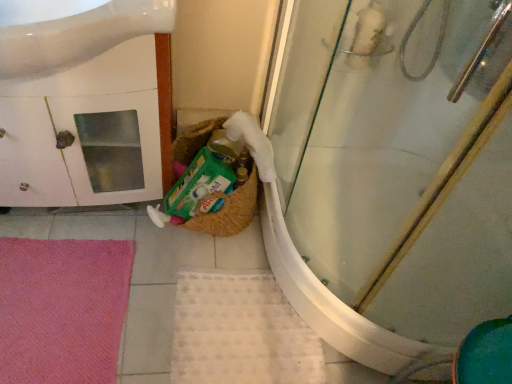
Question: Is white glossy sink at upper left positioned far away from transparent glass shower door at center?

Choices:
 (A) yes
 (B) no

Answer: (B)

Question: Does white glossy sink at upper left turn towards transparent glass shower door at center?

Choices:
 (A) no
 (B) yes

Answer: (A)

Question: Is the position of white glossy sink at upper left less distant than that of transparent glass shower door at center?

Choices:
 (A) no
 (B) yes

Answer: (A)

Question: Is white glossy sink at upper left to the left of transparent glass shower door at center from the viewer's perspective?

Choices:
 (A) no
 (B) yes

Answer: (B)

Question: Is white glossy sink at upper left shorter than transparent glass shower door at center?

Choices:
 (A) yes
 (B) no

Answer: (A)

Question: From the image's perspective, is pink soft bath mat at lower left, which appears as the second bath mat when viewed from the right, positioned above or below white glossy sink at upper left?

Choices:
 (A) below
 (B) above

Answer: (A)

Question: Is point (104, 284) closer or farther from the camera than point (36, 54)?

Choices:
 (A) closer
 (B) farther

Answer: (B)

Question: Would you say pink soft bath mat at lower left, which is the 1th bath mat in left-to-right order, is to the left or to the right of white glossy sink at upper left in the picture?

Choices:
 (A) right
 (B) left

Answer: (B)

Question: Which is correct: pink soft bath mat at lower left, which appears as the second bath mat when viewed from the right, is inside white glossy sink at upper left, or outside of it?

Choices:
 (A) outside
 (B) inside

Answer: (A)

Question: From a real-world perspective, is pink soft bath mat at lower left, which is the 1th bath mat in left-to-right order, positioned above or below transparent glass shower door at center?

Choices:
 (A) below
 (B) above

Answer: (A)

Question: In the image, is pink soft bath mat at lower left, which appears as the second bath mat when viewed from the right, on the left side or the right side of transparent glass shower door at center?

Choices:
 (A) right
 (B) left

Answer: (B)

Question: From the image's perspective, is pink soft bath mat at lower left, which appears as the second bath mat when viewed from the right, located above or below transparent glass shower door at center?

Choices:
 (A) above
 (B) below

Answer: (B)

Question: Is pink soft bath mat at lower left, which appears as the second bath mat when viewed from the right, inside the boundaries of transparent glass shower door at center, or outside?

Choices:
 (A) inside
 (B) outside

Answer: (B)

Question: Is white textured bath mat at lower center, the 2th bath mat from the left, bigger or smaller than pink soft bath mat at lower left, which appears as the second bath mat when viewed from the right?

Choices:
 (A) small
 (B) big

Answer: (A)

Question: Choose the correct answer: Is white textured bath mat at lower center, which appears as the 1th bath mat when viewed from the right, inside pink soft bath mat at lower left, which appears as the second bath mat when viewed from the right, or outside it?

Choices:
 (A) inside
 (B) outside

Answer: (B)